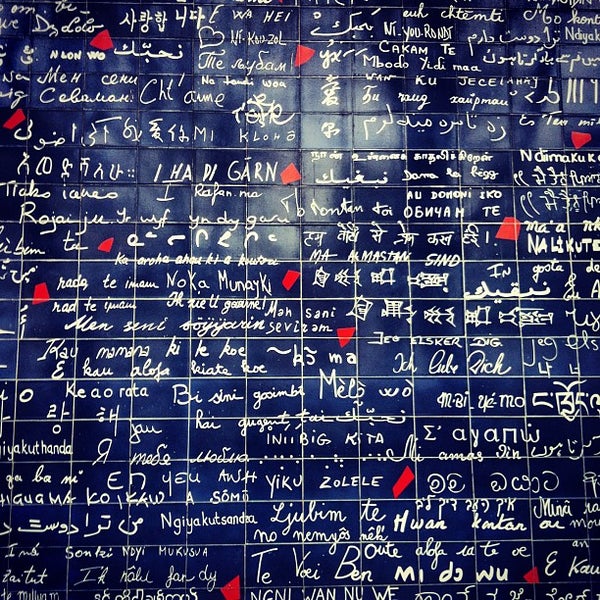
Find the location of a particular element. This screenshot has width=600, height=600. blue tile wall is located at coordinates (254, 304).